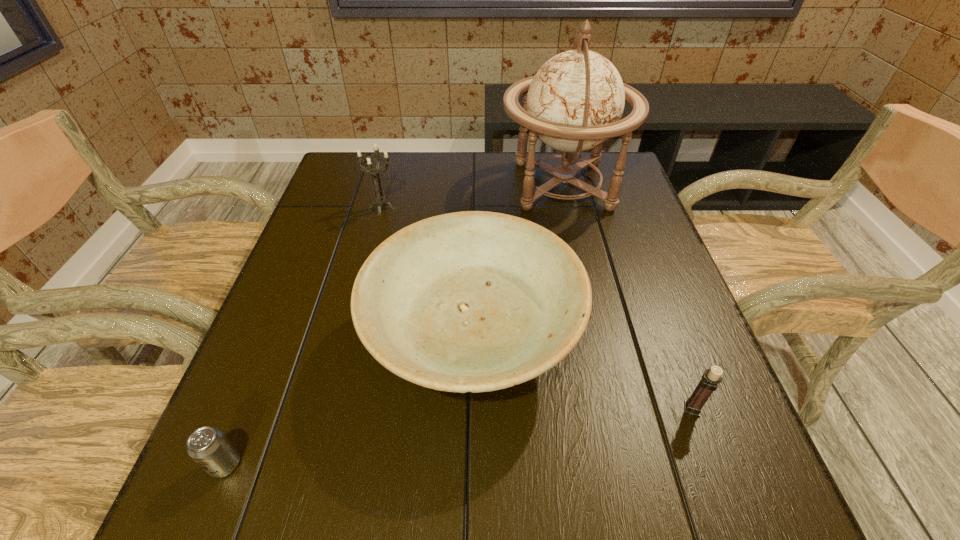
Where is `candle holder located in the right edge section of the desktop`? The image size is (960, 540). candle holder located in the right edge section of the desktop is located at coordinates (710, 379).

This screenshot has height=540, width=960. Find the location of `object located at the near left corner`. object located at the near left corner is located at coordinates (207, 446).

The height and width of the screenshot is (540, 960). I want to click on object present at the far right corner, so click(575, 101).

In the image, there is a desktop. Where is `vacant area at the far edge`? The height and width of the screenshot is (540, 960). vacant area at the far edge is located at coordinates (404, 157).

Locate an element on the screen. Image resolution: width=960 pixels, height=540 pixels. vacant space at the near edge of the desktop is located at coordinates (545, 494).

The image size is (960, 540). I want to click on free space at the left edge, so click(x=306, y=280).

Identify the location of free space at the right edge of the desktop. The image size is (960, 540). (590, 236).

Find the location of a particular element. free space at the far left corner of the desktop is located at coordinates (372, 189).

You are a GUI agent. You are given a task and a screenshot of the screen. Output one action in this format:
    pyautogui.click(x=<x>, y=<y>)
    Task: Click on the vacant point located between the second shortest object and the tallest object
    This screenshot has height=540, width=960.
    Given the screenshot: What is the action you would take?
    pyautogui.click(x=627, y=297)

Find the location of a particular element. empty space that is in between the leftmost object and the nearer candle holder is located at coordinates (459, 436).